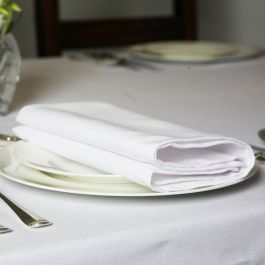
At what (x,y) coordinates should I click in order to perform the action: click on round white salad plates. Please return your answer as a coordinate pair (x, y). The height and width of the screenshot is (265, 265). Looking at the image, I should click on (67, 168), (172, 51).